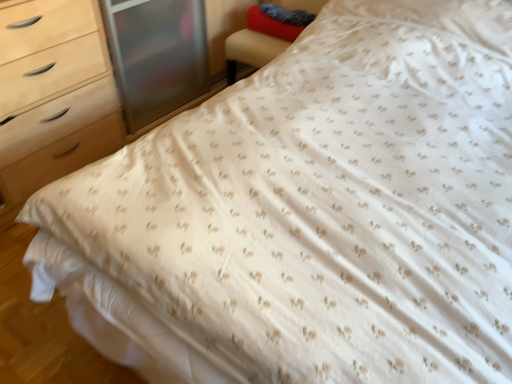
Question: Does velvet-like red pillow at upper right, arranged as the first pillow when viewed from the back, have a larger size compared to red fabric armchair at upper right?

Choices:
 (A) no
 (B) yes

Answer: (A)

Question: Is velvet-like red pillow at upper right, which appears as the second pillow when viewed from the front, positioned far away from red fabric armchair at upper right?

Choices:
 (A) no
 (B) yes

Answer: (A)

Question: Considering the relative sizes of velvet-like red pillow at upper right, which appears as the second pillow when viewed from the front, and red fabric armchair at upper right in the image provided, is velvet-like red pillow at upper right, which appears as the second pillow when viewed from the front, shorter than red fabric armchair at upper right?

Choices:
 (A) yes
 (B) no

Answer: (A)

Question: Can red fabric armchair at upper right be found inside velvet-like red pillow at upper right, which appears as the second pillow when viewed from the front?

Choices:
 (A) yes
 (B) no

Answer: (B)

Question: Considering the relative sizes of velvet-like red pillow at upper right, arranged as the first pillow when viewed from the back, and red fabric armchair at upper right in the image provided, is velvet-like red pillow at upper right, arranged as the first pillow when viewed from the back, thinner than red fabric armchair at upper right?

Choices:
 (A) no
 (B) yes

Answer: (B)

Question: Considering the relative positions of velvet-like red pillow at upper right, arranged as the first pillow when viewed from the back, and red fabric armchair at upper right in the image provided, is velvet-like red pillow at upper right, arranged as the first pillow when viewed from the back, behind red fabric armchair at upper right?

Choices:
 (A) yes
 (B) no

Answer: (A)

Question: Does red fabric armchair at upper right have a larger size compared to velvet-like red pillow at upper right, arranged as the first pillow when viewed from the back?

Choices:
 (A) no
 (B) yes

Answer: (B)

Question: Is red fabric armchair at upper right oriented away from velvet-like red pillow at upper right, which appears as the second pillow when viewed from the front?

Choices:
 (A) no
 (B) yes

Answer: (B)

Question: Is the surface of red fabric armchair at upper right in direct contact with velvet-like red pillow at upper right, which appears as the second pillow when viewed from the front?

Choices:
 (A) yes
 (B) no

Answer: (A)

Question: Would you say red fabric armchair at upper right is a long distance from velvet-like red pillow at upper right, arranged as the first pillow when viewed from the back?

Choices:
 (A) no
 (B) yes

Answer: (A)

Question: From the image's perspective, is red fabric armchair at upper right over velvet-like red pillow at upper right, which appears as the second pillow when viewed from the front?

Choices:
 (A) no
 (B) yes

Answer: (A)

Question: Does red fabric armchair at upper right have a greater height compared to velvet-like red pillow at upper right, which appears as the second pillow when viewed from the front?

Choices:
 (A) no
 (B) yes

Answer: (B)

Question: Could you tell me if velvet blue pillow at upper right, which is the first pillow in front-to-back order, is facing velvet-like red pillow at upper right, which appears as the second pillow when viewed from the front?

Choices:
 (A) yes
 (B) no

Answer: (B)